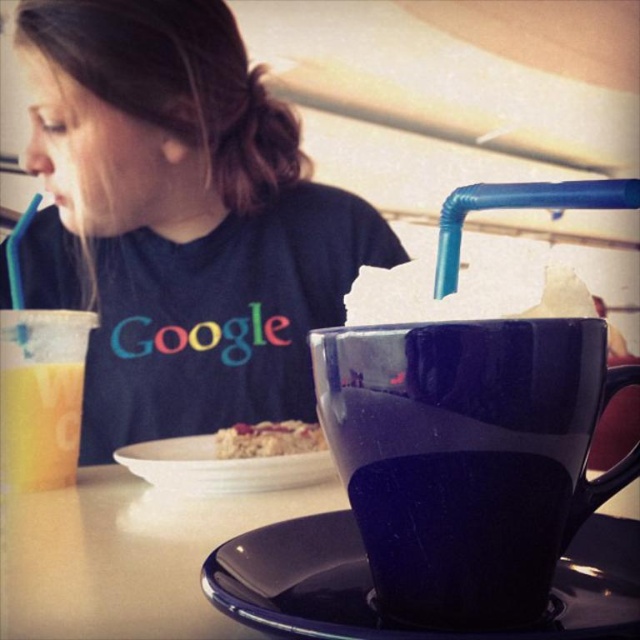
Does matte black t-shirt at upper left lie behind glossy ceramic saucer at lower center?

Yes, it is behind glossy ceramic saucer at lower center.

Is matte black t-shirt at upper left smaller than glossy ceramic saucer at lower center?

Incorrect, matte black t-shirt at upper left is not smaller in size than glossy ceramic saucer at lower center.

Between point (228, 13) and point (275, 624), which one is positioned behind?

The point (228, 13) is behind.

Locate an element on the screen. matte black t-shirt at upper left is located at coordinates (179, 220).

Can you confirm if translucent plastic cup at left is positioned above crumbly oatmeal bar at center?

Correct, translucent plastic cup at left is located above crumbly oatmeal bar at center.

Locate an element on the screen. translucent plastic cup at left is located at coordinates (40, 396).

What do you see at coordinates (467, 456) in the screenshot? I see `glossy ceramic mug at upper center` at bounding box center [467, 456].

Is point (316, 342) behind point (218, 438)?

No, (316, 342) is in front of (218, 438).

Locate an element on the screen. glossy ceramic mug at upper center is located at coordinates (467, 456).